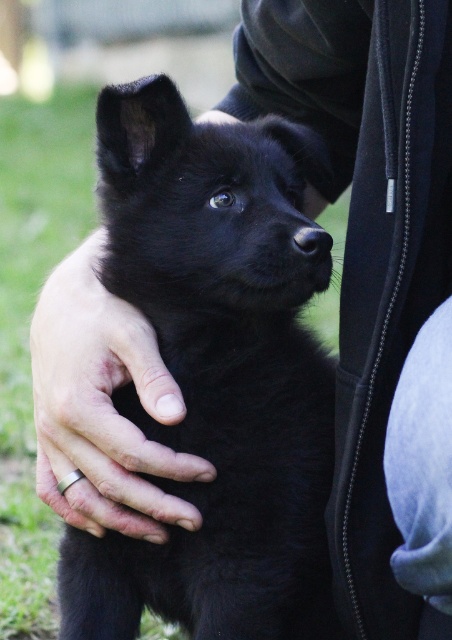
You are a photographer trying to capture a closeup shot of the black furry dog at center. The camera you are using has a minimum focusing distance of 36 inches. Will you be able to take the photo without moving closer?

The distance between the black furry dog at center and the camera is 38.43 inches, which is greater than the camera minimum focusing distance of 36 inches. Therefore, you can take the photo without moving closer.

What is located at the coordinates point (216, 374) in the image?

The point (216, 374) marks the location of the black furry dog at center.